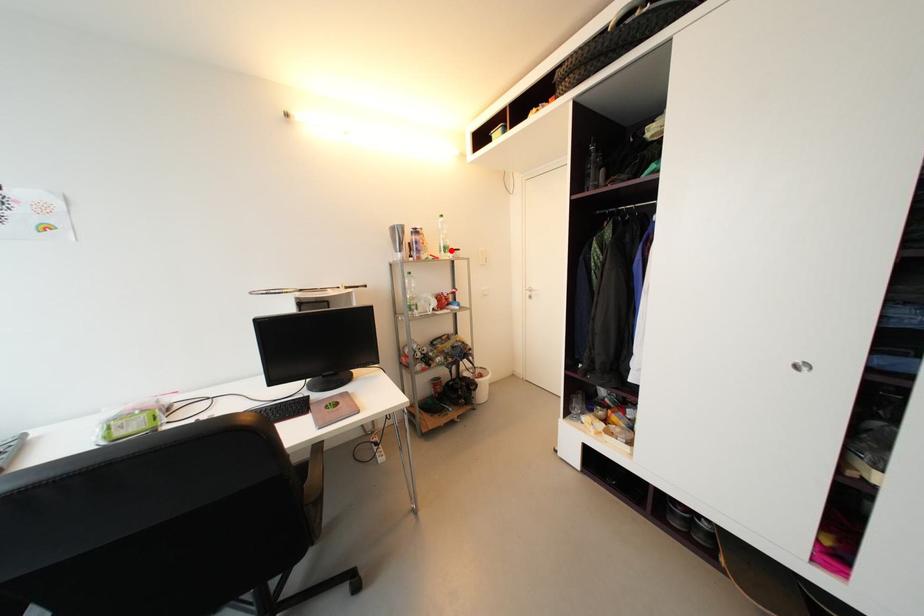
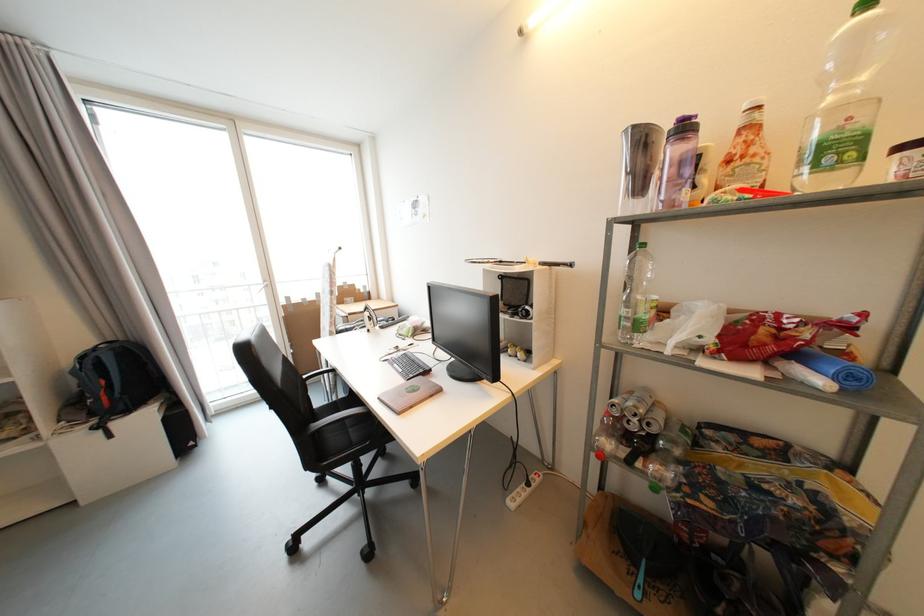
In the second image, find the point that corresponds to the highlighted location in the first image.

(842, 151)